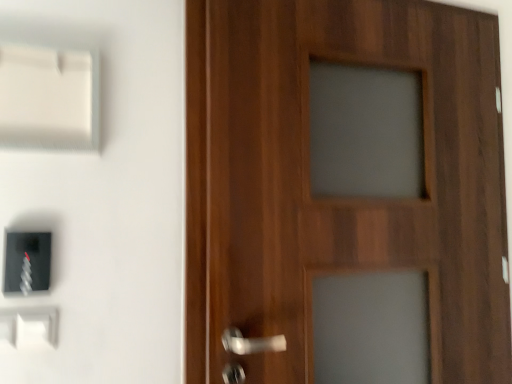
Find the location of a particular element. This screenshot has width=512, height=384. white plastic light switch at upper left, the first light switch in the top-to-bottom sequence is located at coordinates (48, 98).

Measure the distance between point (x=496, y=378) and camera.

1.29 meters.

Where is `black plastic light switch at lower left, the second light switch from the bottom`? The height and width of the screenshot is (384, 512). black plastic light switch at lower left, the second light switch from the bottom is located at coordinates (x=27, y=262).

What do you see at coordinates (27, 262) in the screenshot?
I see `black plastic light switch at lower left, the second light switch from the bottom` at bounding box center [27, 262].

Where is `white plastic light switch at upper left, the first light switch in the top-to-bottom sequence`? Image resolution: width=512 pixels, height=384 pixels. white plastic light switch at upper left, the first light switch in the top-to-bottom sequence is located at coordinates (48, 98).

Consider the image. Is white plastic light switch at lower left, the third light switch from the top, at the right side of wooden door at right?

Incorrect, white plastic light switch at lower left, the third light switch from the top, is not on the right side of wooden door at right.

Are white plastic light switch at lower left, the first light switch positioned from the bottom, and wooden door at right far apart?

No, there isn't a large distance between white plastic light switch at lower left, the first light switch positioned from the bottom, and wooden door at right.

Based on the photo, can you confirm if white plastic light switch at lower left, the first light switch positioned from the bottom, is bigger than wooden door at right?

No.

Does white plastic light switch at lower left, the first light switch positioned from the bottom, have a lesser height compared to wooden door at right?

Correct, white plastic light switch at lower left, the first light switch positioned from the bottom, is not as tall as wooden door at right.

Is black plastic light switch at lower left, which is the 2th light switch in top-to-bottom order, not inside white plastic light switch at upper left, the third light switch when ordered from bottom to top?

black plastic light switch at lower left, which is the 2th light switch in top-to-bottom order, lies outside white plastic light switch at upper left, the third light switch when ordered from bottom to top,'s area.

Is point (38, 290) positioned after point (76, 137)?

No, it is not.

From a real-world perspective, relative to white plastic light switch at upper left, the third light switch when ordered from bottom to top, is black plastic light switch at lower left, the second light switch from the bottom, vertically above or below?

From a real-world perspective, black plastic light switch at lower left, the second light switch from the bottom, is physically below white plastic light switch at upper left, the third light switch when ordered from bottom to top.

In the scene shown: Is white plastic light switch at upper left, the first light switch in the top-to-bottom sequence, not within white plastic light switch at lower left, the first light switch positioned from the bottom?

Yes, white plastic light switch at upper left, the first light switch in the top-to-bottom sequence, is not within white plastic light switch at lower left, the first light switch positioned from the bottom.

Considering the positions of objects white plastic light switch at upper left, the third light switch when ordered from bottom to top, and white plastic light switch at lower left, the third light switch from the top, in the image provided, who is more to the right, white plastic light switch at upper left, the third light switch when ordered from bottom to top, or white plastic light switch at lower left, the third light switch from the top,?

Positioned to the right is white plastic light switch at upper left, the third light switch when ordered from bottom to top.

Is white plastic light switch at upper left, the first light switch in the top-to-bottom sequence, not near white plastic light switch at lower left, the third light switch from the top?

white plastic light switch at upper left, the first light switch in the top-to-bottom sequence, is actually quite close to white plastic light switch at lower left, the third light switch from the top.

How distant is white plastic light switch at upper left, the first light switch in the top-to-bottom sequence, from white plastic light switch at lower left, the third light switch from the top?

17.87 inches.

Considering the relative sizes of white plastic light switch at lower left, the third light switch from the top, and black plastic light switch at lower left, the second light switch from the bottom, in the image provided, is white plastic light switch at lower left, the third light switch from the top, taller than black plastic light switch at lower left, the second light switch from the bottom,?

No.

Is white plastic light switch at lower left, the third light switch from the top, facing towards black plastic light switch at lower left, the second light switch from the bottom?

No, white plastic light switch at lower left, the third light switch from the top, is not turned towards black plastic light switch at lower left, the second light switch from the bottom.

Considering the relative positions of white plastic light switch at lower left, the first light switch positioned from the bottom, and black plastic light switch at lower left, which is the 2th light switch in top-to-bottom order, in the image provided, is white plastic light switch at lower left, the first light switch positioned from the bottom, to the right of black plastic light switch at lower left, which is the 2th light switch in top-to-bottom order, from the viewer's perspective?

No.

Is black plastic light switch at lower left, which is the 2th light switch in top-to-bottom order, turned away from white plastic light switch at lower left, the third light switch from the top?

That's not correct — black plastic light switch at lower left, which is the 2th light switch in top-to-bottom order, is not looking away from white plastic light switch at lower left, the third light switch from the top.

Is black plastic light switch at lower left, the second light switch from the bottom, not within white plastic light switch at lower left, the first light switch positioned from the bottom?

Yes, black plastic light switch at lower left, the second light switch from the bottom, is outside of white plastic light switch at lower left, the first light switch positioned from the bottom.

Is black plastic light switch at lower left, the second light switch from the bottom, bigger or smaller than white plastic light switch at lower left, the third light switch from the top?

black plastic light switch at lower left, the second light switch from the bottom, is bigger than white plastic light switch at lower left, the third light switch from the top.

Is black plastic light switch at lower left, the second light switch from the bottom, positioned beyond the bounds of wooden door at right?

Indeed, black plastic light switch at lower left, the second light switch from the bottom, is completely outside wooden door at right.

Which is behind, black plastic light switch at lower left, the second light switch from the bottom, or wooden door at right?

wooden door at right is further away from the camera.

How many degrees apart are the facing directions of black plastic light switch at lower left, which is the 2th light switch in top-to-bottom order, and wooden door at right?

The facing directions of black plastic light switch at lower left, which is the 2th light switch in top-to-bottom order, and wooden door at right are 0.0689 degrees apart.

Is black plastic light switch at lower left, which is the 2th light switch in top-to-bottom order, next to wooden door at right?

No, black plastic light switch at lower left, which is the 2th light switch in top-to-bottom order, is not touching wooden door at right.

Is white plastic light switch at upper left, the third light switch when ordered from bottom to top, surrounded by white plastic light switch at lower left, the first light switch positioned from the bottom?

No.

Considering the relative sizes of white plastic light switch at lower left, the first light switch positioned from the bottom, and white plastic light switch at upper left, the third light switch when ordered from bottom to top, in the image provided, is white plastic light switch at lower left, the first light switch positioned from the bottom, bigger than white plastic light switch at upper left, the third light switch when ordered from bottom to top,?

Incorrect, white plastic light switch at lower left, the first light switch positioned from the bottom, is not larger than white plastic light switch at upper left, the third light switch when ordered from bottom to top.

Can you confirm if white plastic light switch at lower left, the third light switch from the top, is positioned to the right of white plastic light switch at upper left, the first light switch in the top-to-bottom sequence?

Incorrect, white plastic light switch at lower left, the third light switch from the top, is not on the right side of white plastic light switch at upper left, the first light switch in the top-to-bottom sequence.

Is white plastic light switch at lower left, the first light switch positioned from the bottom, facing towards white plastic light switch at upper left, the third light switch when ordered from bottom to top?

No, white plastic light switch at lower left, the first light switch positioned from the bottom, does not turn towards white plastic light switch at upper left, the third light switch when ordered from bottom to top.

The image size is (512, 384). There is a wooden door at right. In order to click on the 2nd light switch below it (from a real-world perspective) in this screenshot , I will do `click(29, 327)`.

Where is `light switch that is the 1st object located below the white plastic light switch at upper left, the first light switch in the top-to-bottom sequence (from the image's perspective)`? light switch that is the 1st object located below the white plastic light switch at upper left, the first light switch in the top-to-bottom sequence (from the image's perspective) is located at coordinates click(x=27, y=262).

Which object lies further to the anchor point wooden door at right, black plastic light switch at lower left, the second light switch from the bottom, or white plastic light switch at upper left, the third light switch when ordered from bottom to top?

Based on the image, black plastic light switch at lower left, the second light switch from the bottom, appears to be further to wooden door at right.

From the image, which object appears to be farther from black plastic light switch at lower left, which is the 2th light switch in top-to-bottom order, white plastic light switch at lower left, the third light switch from the top, or wooden door at right?

Based on the image, wooden door at right appears to be further to black plastic light switch at lower left, which is the 2th light switch in top-to-bottom order.

Considering their positions, is wooden door at right positioned further to white plastic light switch at upper left, the third light switch when ordered from bottom to top, than white plastic light switch at lower left, the first light switch positioned from the bottom?

wooden door at right is positioned further to the anchor white plastic light switch at upper left, the third light switch when ordered from bottom to top.

Estimate the real-world distances between objects in this image. Which object is closer to white plastic light switch at upper left, the third light switch when ordered from bottom to top, black plastic light switch at lower left, the second light switch from the bottom, or white plastic light switch at lower left, the first light switch positioned from the bottom?

black plastic light switch at lower left, the second light switch from the bottom, lies closer to white plastic light switch at upper left, the third light switch when ordered from bottom to top, than the other object.

Which object lies nearer to the anchor point wooden door at right, white plastic light switch at upper left, the third light switch when ordered from bottom to top, or white plastic light switch at lower left, the first light switch positioned from the bottom?

white plastic light switch at upper left, the third light switch when ordered from bottom to top, lies closer to wooden door at right than the other object.

Looking at the image, which one is located closer to black plastic light switch at lower left, which is the 2th light switch in top-to-bottom order, white plastic light switch at upper left, the third light switch when ordered from bottom to top, or white plastic light switch at lower left, the first light switch positioned from the bottom?

→ white plastic light switch at lower left, the first light switch positioned from the bottom, is positioned closer to the anchor black plastic light switch at lower left, which is the 2th light switch in top-to-bottom order.

Based on their spatial positions, is black plastic light switch at lower left, the second light switch from the bottom, or white plastic light switch at upper left, the third light switch when ordered from bottom to top, closer to white plastic light switch at lower left, the third light switch from the top?

black plastic light switch at lower left, the second light switch from the bottom, is closer to white plastic light switch at lower left, the third light switch from the top.

Estimate the real-world distances between objects in this image. Which object is further from wooden door at right, white plastic light switch at lower left, the third light switch from the top, or black plastic light switch at lower left, which is the 2th light switch in top-to-bottom order?

Among the two, white plastic light switch at lower left, the third light switch from the top, is located further to wooden door at right.

Image resolution: width=512 pixels, height=384 pixels. In order to click on light switch located between white plastic light switch at upper left, the third light switch when ordered from bottom to top, and wooden door at right in the left-right direction in this screenshot , I will do `click(27, 262)`.

This screenshot has height=384, width=512. In order to click on light switch between white plastic light switch at upper left, the third light switch when ordered from bottom to top, and white plastic light switch at lower left, the first light switch positioned from the bottom, vertically in this screenshot , I will do `click(27, 262)`.